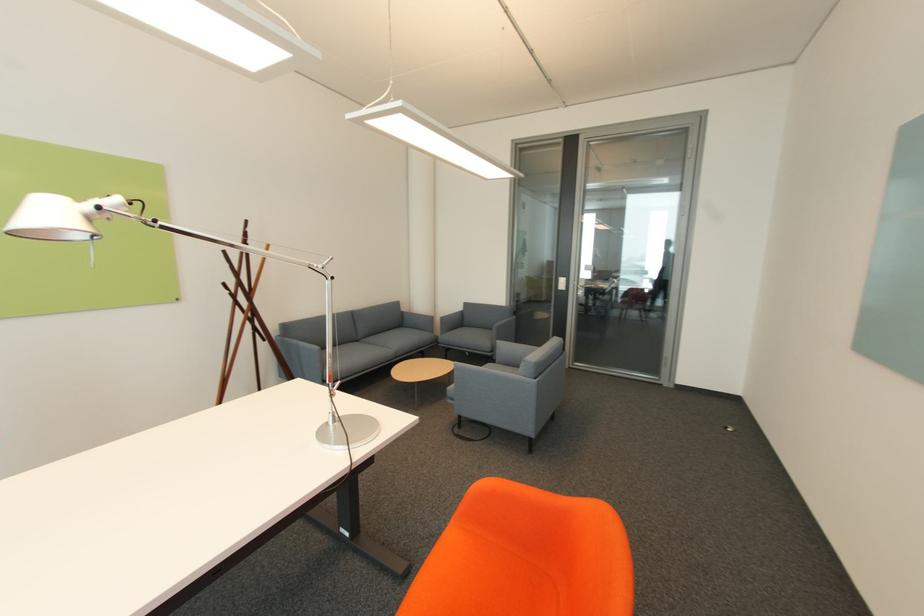
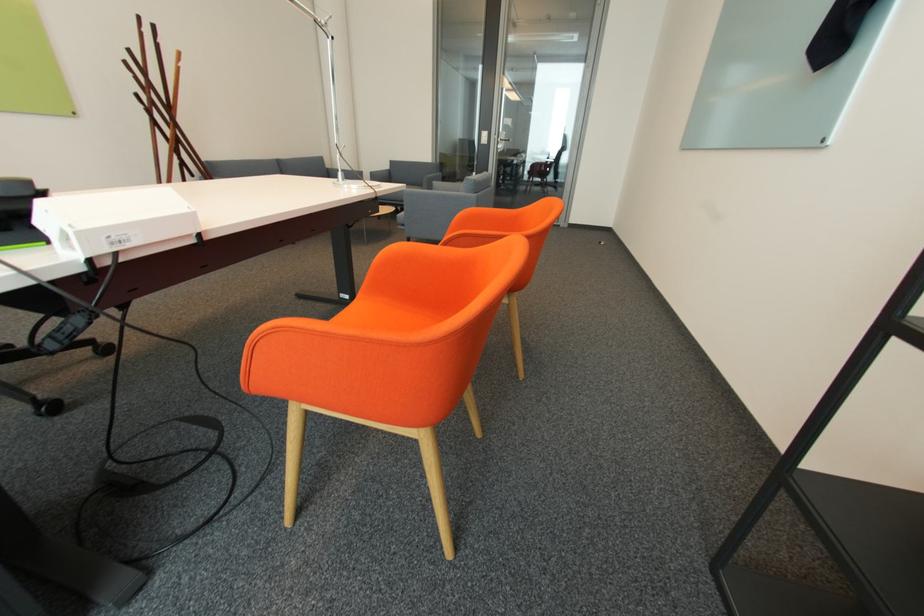
Where in the second image is the point corresponding to (458,400) from the first image?

(408, 225)